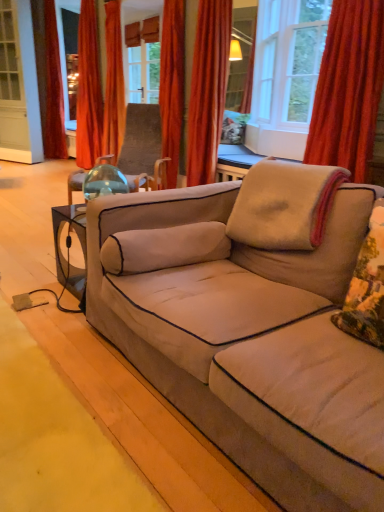
Question: Should I look upward or downward to see orange velvet curtain at upper center, the third curtain when ordered from back to front?

Choices:
 (A) down
 (B) up

Answer: (B)

Question: From the image's perspective, would you say velvet orange curtain at upper right, positioned as the 1th curtain in right-to-left order, is positioned over orange velvet curtain at upper left, arranged as the 4th curtain when viewed from the front?

Choices:
 (A) yes
 (B) no

Answer: (B)

Question: Is velvet orange curtain at upper right, the fifth curtain when ordered from back to front, shorter than orange velvet curtain at upper left, the 4th curtain viewed from the right?

Choices:
 (A) yes
 (B) no

Answer: (A)

Question: Is velvet orange curtain at upper right, marked as the fifth curtain in a left-to-right arrangement, not within orange velvet curtain at upper left, which ranks as the second curtain in back-to-front order?

Choices:
 (A) yes
 (B) no

Answer: (A)

Question: Is velvet orange curtain at upper right, the 1th curtain from the front, in front of orange velvet curtain at upper left, the 4th curtain viewed from the right?

Choices:
 (A) yes
 (B) no

Answer: (A)

Question: Considering the relative sizes of velvet orange curtain at upper right, marked as the fifth curtain in a left-to-right arrangement, and orange velvet curtain at upper left, the 4th curtain viewed from the right, in the image provided, is velvet orange curtain at upper right, marked as the fifth curtain in a left-to-right arrangement, taller than orange velvet curtain at upper left, the 4th curtain viewed from the right,?

Choices:
 (A) yes
 (B) no

Answer: (B)

Question: From a real-world perspective, is velvet orange curtain at upper right, marked as the fifth curtain in a left-to-right arrangement, under orange velvet curtain at upper left, which ranks as the second curtain in back-to-front order?

Choices:
 (A) no
 (B) yes

Answer: (A)

Question: Is velvet red curtain at left, which is counted as the fifth curtain, starting from the right, looking in the opposite direction of velvet orange curtain at upper center, the 2th curtain when ordered from right to left?

Choices:
 (A) yes
 (B) no

Answer: (B)

Question: Can you confirm if velvet red curtain at left, which ranks as the 1th curtain in left-to-right order, is smaller than velvet orange curtain at upper center, the 2th curtain when ordered from right to left?

Choices:
 (A) no
 (B) yes

Answer: (A)

Question: Considering the relative sizes of velvet red curtain at left, which is counted as the fifth curtain, starting from the right, and velvet orange curtain at upper center, placed as the 4th curtain when sorted from left to right, in the image provided, is velvet red curtain at left, which is counted as the fifth curtain, starting from the right, bigger than velvet orange curtain at upper center, placed as the 4th curtain when sorted from left to right,?

Choices:
 (A) no
 (B) yes

Answer: (B)

Question: From the image's perspective, is velvet red curtain at left, which ranks as the 1th curtain in left-to-right order, under velvet orange curtain at upper center, the 2th curtain when ordered from right to left?

Choices:
 (A) yes
 (B) no

Answer: (B)

Question: Is velvet red curtain at left, which is counted as the fifth curtain, starting from the right, further to the viewer compared to velvet orange curtain at upper center, the 4th curtain when ordered from back to front?

Choices:
 (A) yes
 (B) no

Answer: (A)

Question: Can we say velvet red curtain at left, the fifth curtain positioned from the front, lies outside velvet orange curtain at upper center, the 2th curtain when ordered from right to left?

Choices:
 (A) yes
 (B) no

Answer: (A)

Question: Is velvet red curtain at left, placed as the first curtain when sorted from back to front, placed right next to beige fabric couch at center?

Choices:
 (A) no
 (B) yes

Answer: (A)